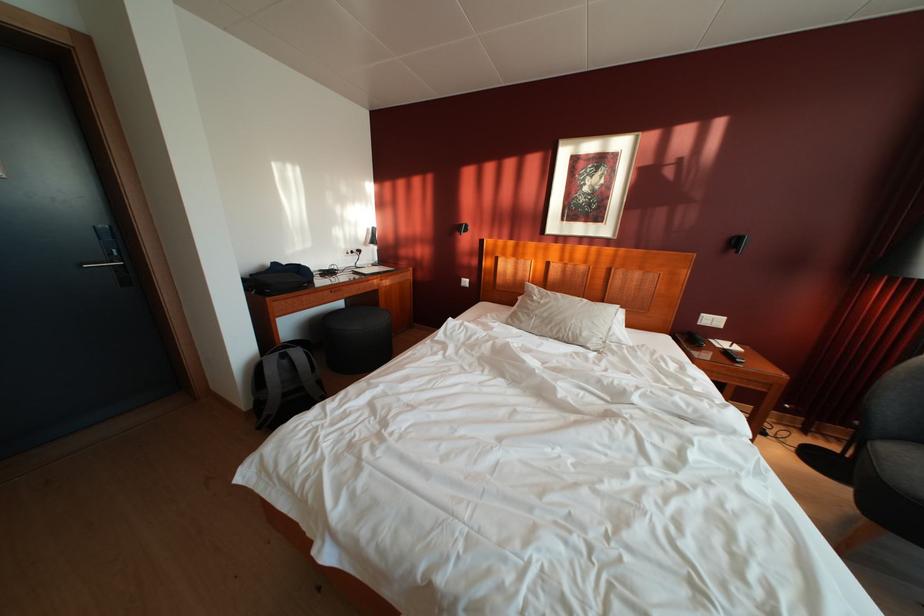
The location [563,317] corresponds to which object?

This point indicates the gray pillow.